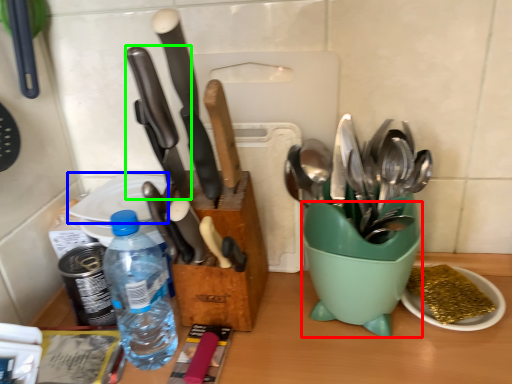
Question: Estimate the real-world distances between objects in this image. Which object is farther from mixing bowl (highlighted by a red box), plate (highlighted by a blue box) or kitchen knife (highlighted by a green box)?

Choices:
 (A) plate
 (B) kitchen knife

Answer: (A)